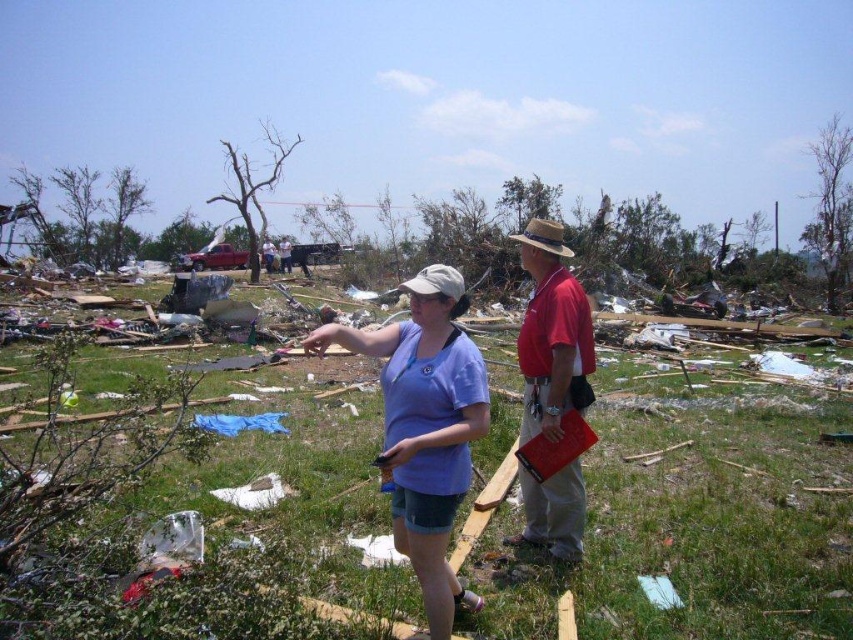
You are a disaster relief worker assessing the damage in the area. You notice a point marked at coordinates (552, 333). What object or person is located at that point?

The point at coordinates (552, 333) indicates the red cotton shirt at center.